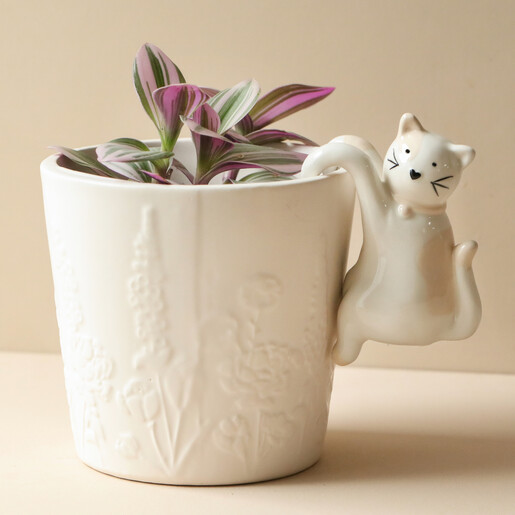
Find the location of a particular element. plant is located at coordinates (210, 118).